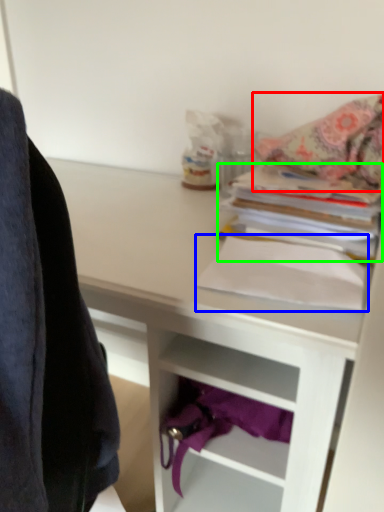
Question: Which object is the farthest from blanket (highlighted by a red box)? Choose among these: paperback book (highlighted by a blue box) or paperback book (highlighted by a green box).

Choices:
 (A) paperback book
 (B) paperback book

Answer: (A)